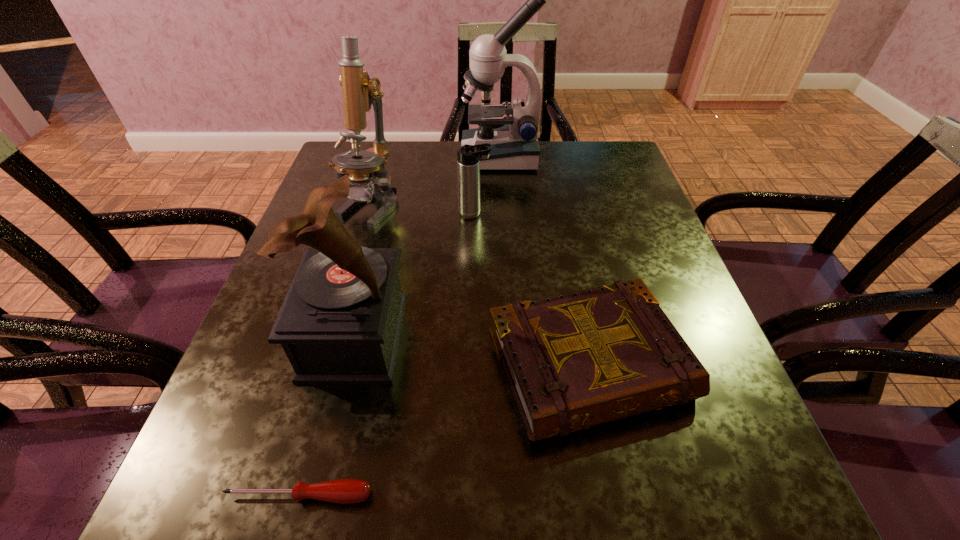
Where is `object located in the right edge section of the desktop`? The width and height of the screenshot is (960, 540). object located in the right edge section of the desktop is located at coordinates (575, 360).

The width and height of the screenshot is (960, 540). Find the location of `object positioned at the far left corner`. object positioned at the far left corner is located at coordinates (359, 92).

Where is `object present at the near left corner`? The width and height of the screenshot is (960, 540). object present at the near left corner is located at coordinates (343, 491).

You are a GUI agent. You are given a task and a screenshot of the screen. Output one action in this format:
    pyautogui.click(x=<x>, y=<y>)
    Task: Click on the free spot at the far edge of the desktop
    
    Given the screenshot: What is the action you would take?
    pyautogui.click(x=400, y=157)

You are a GUI agent. You are given a task and a screenshot of the screen. Output one action in this format:
    pyautogui.click(x=<x>, y=<y>)
    Task: Click on the blank space at the near edge of the desktop
    
    Given the screenshot: What is the action you would take?
    pyautogui.click(x=458, y=486)

In the image, there is a desktop. In order to click on free region at the right edge in this screenshot , I will do `click(684, 319)`.

This screenshot has width=960, height=540. Find the location of `vacant space at the far left corner of the desktop`. vacant space at the far left corner of the desktop is located at coordinates (387, 163).

This screenshot has height=540, width=960. I want to click on vacant space at the near left corner of the desktop, so click(264, 509).

The width and height of the screenshot is (960, 540). Find the location of `free spot between the second shortest object and the left microscope`. free spot between the second shortest object and the left microscope is located at coordinates (478, 286).

The width and height of the screenshot is (960, 540). In order to click on vacant point located between the thermos bottle and the third tallest object in this screenshot , I will do `click(415, 275)`.